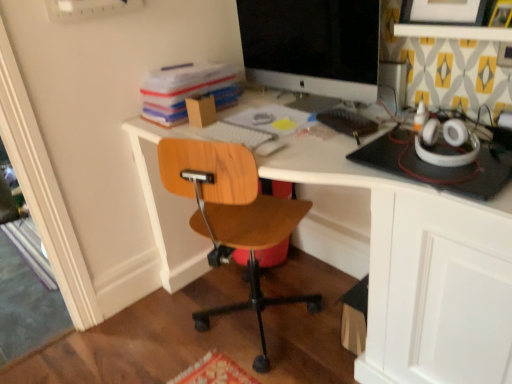
Question: Is stacked paperboard at upper left spatially inside satin black monitor at upper center, or outside of it?

Choices:
 (A) inside
 (B) outside

Answer: (B)

Question: In the image, is stacked paperboard at upper left positioned in front of or behind satin black monitor at upper center?

Choices:
 (A) behind
 (B) front

Answer: (A)

Question: Considering the real-world distances, which object is closest to the matte black picture frame at upper right?

Choices:
 (A) satin black monitor at upper center
 (B) white glossy desk at center
 (C) wooden chair at center
 (D) stacked paperboard at upper left

Answer: (A)

Question: Which object is the closest to the satin black monitor at upper center?

Choices:
 (A) white glossy desk at center
 (B) stacked paperboard at upper left
 (C) wooden chair at center
 (D) matte black picture frame at upper right

Answer: (B)